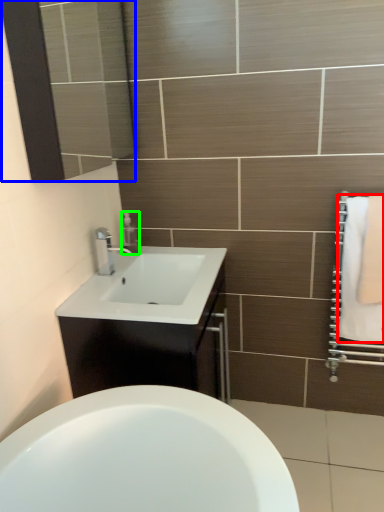
Question: Based on their relative distances, which object is nearer to bath towel (highlighted by a red box)? Choose from mirror (highlighted by a blue box) and soap dispenser (highlighted by a green box).

Choices:
 (A) mirror
 (B) soap dispenser

Answer: (B)